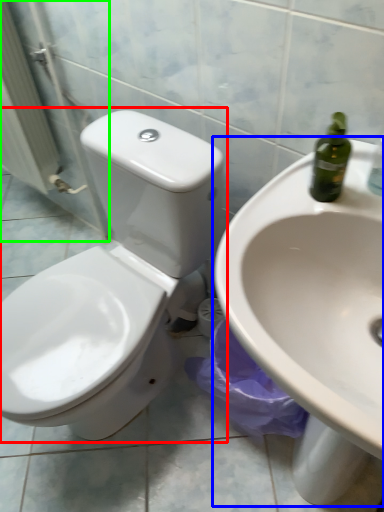
Question: Which object is the farthest from toilet (highlighted by a red box)? Choose among these: sink (highlighted by a blue box) or screen door (highlighted by a green box).

Choices:
 (A) sink
 (B) screen door

Answer: (B)